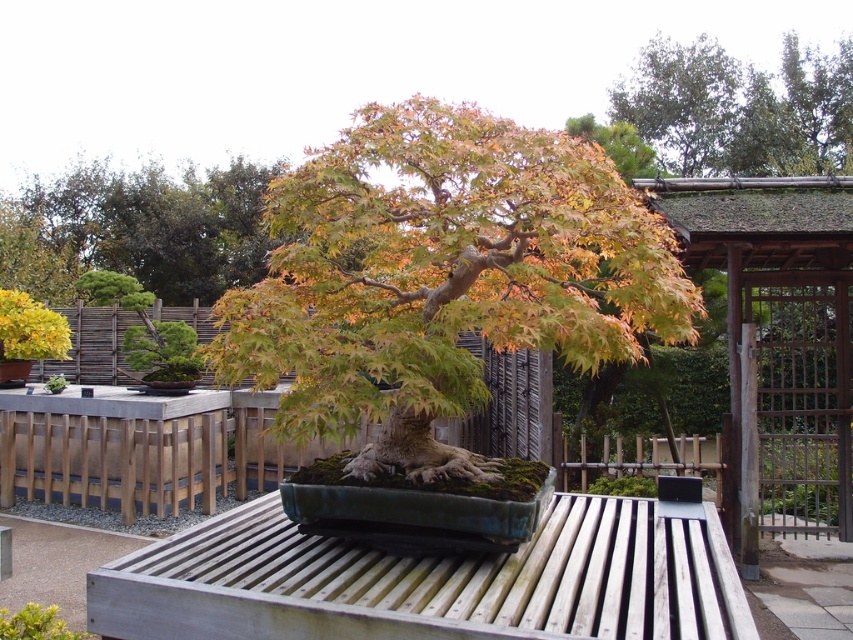
Is shiny orange-brown bonsai tree at center closer to the viewer compared to orange-brown bark tree at upper center?

Yes, it is in front of orange-brown bark tree at upper center.

Who is positioned more to the left, shiny orange-brown bonsai tree at center or orange-brown bark tree at upper center?

From the viewer's perspective, orange-brown bark tree at upper center appears more on the left side.

Who is more forward, (583, 257) or (67, 209)?

Positioned in front is point (583, 257).

Where is `shiny orange-brown bonsai tree at center`? shiny orange-brown bonsai tree at center is located at coordinates (440, 276).